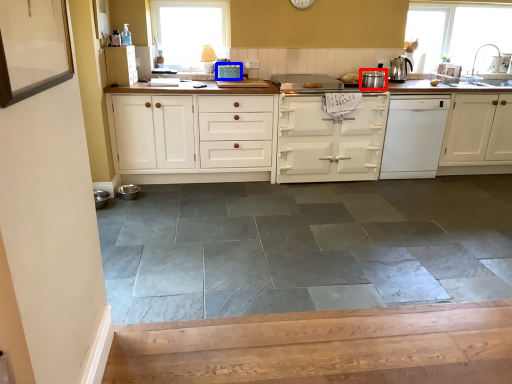
Question: Which point is closer to the camera, appliance (highlighted by a red box) or appliance (highlighted by a blue box)?

Choices:
 (A) appliance
 (B) appliance

Answer: (A)